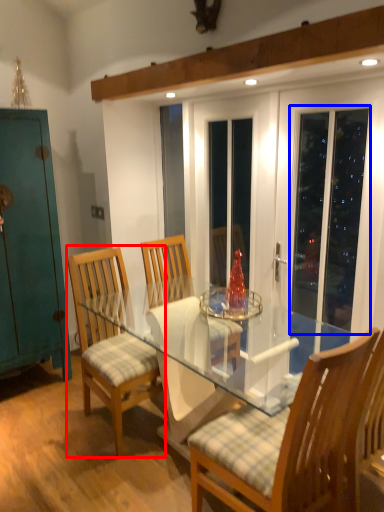
Question: Which object appears closest to the camera in this image, chair (highlighted by a red box) or screen door (highlighted by a blue box)?

Choices:
 (A) chair
 (B) screen door

Answer: (B)